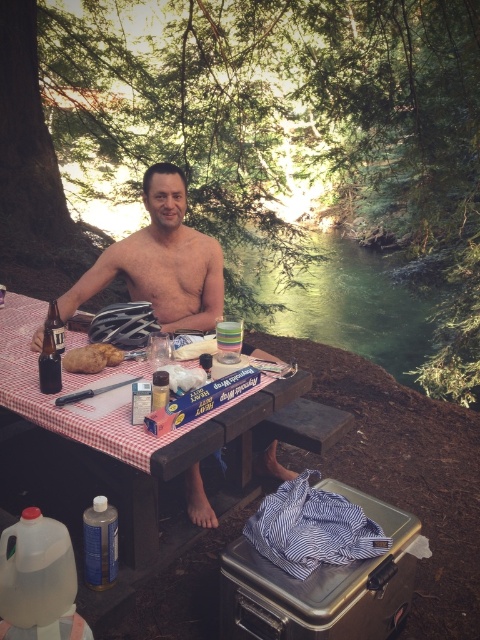
Question: Which point is farther to the camera?

Choices:
 (A) wooden picnic table at center
 (B) brown crumbly bread at table front

Answer: (B)

Question: Observing the image, what is the correct spatial positioning of wooden picnic table at center in reference to brown crumbly bread at table front?

Choices:
 (A) right
 (B) left

Answer: (B)

Question: Can you confirm if wooden picnic table at center is thinner than brown crumbly bread at table front?

Choices:
 (A) yes
 (B) no

Answer: (B)

Question: Which of the following is the closest to the observer?

Choices:
 (A) wooden picnic table at center
 (B) brown crumbly bread at table front

Answer: (A)

Question: Observing the image, what is the correct spatial positioning of wooden picnic table at center in reference to brown crumbly bread at table front?

Choices:
 (A) below
 (B) above

Answer: (B)

Question: Among these points, which one is farthest from the camera?

Choices:
 (A) (88, 365)
 (B) (238, 401)

Answer: (A)